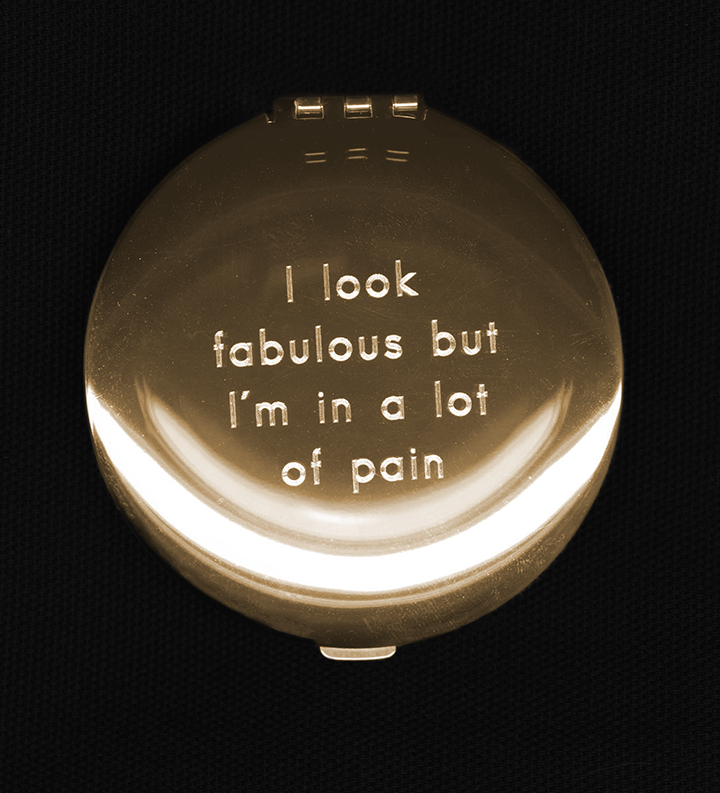
Where is `table`? Image resolution: width=720 pixels, height=793 pixels. table is located at coordinates (667, 285), (122, 686), (48, 307), (626, 711), (548, 510).